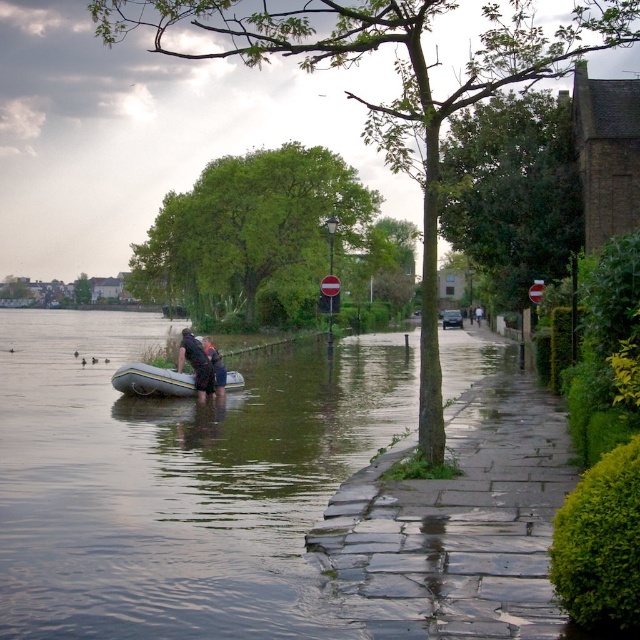
Which of these two, yellow rubber raft at lower left or dark blue fabric jacket at lower center, stands taller?

dark blue fabric jacket at lower center

At what (x,y) coordinates should I click in order to perform the action: click on yellow rubber raft at lower left. Please return your answer as a coordinate pair (x, y). This screenshot has height=640, width=640. Looking at the image, I should click on (152, 380).

The width and height of the screenshot is (640, 640). I want to click on yellow rubber raft at lower left, so click(152, 380).

Does translucent rubber raft at lower left have a lesser width compared to dark blue fabric person at center?

Incorrect, translucent rubber raft at lower left's width is not less than dark blue fabric person at center's.

In the scene shown: Can you confirm if translucent rubber raft at lower left is positioned below dark blue fabric person at center?

Indeed, translucent rubber raft at lower left is positioned under dark blue fabric person at center.

Which is behind, point (33, 509) or point (214, 349)?

The point (214, 349) is more distant.

At what (x,y) coordinates should I click in order to perform the action: click on translucent rubber raft at lower left. Please return your answer as a coordinate pair (x, y). This screenshot has width=640, height=640. Looking at the image, I should click on (177, 481).

How far apart are dark blue fabric jacket at lower center and dark blue fabric person at center?

They are 90.10 centimeters apart.

Can you confirm if dark blue fabric jacket at lower center is taller than dark blue fabric person at center?

Yes.

Which is behind, point (196, 353) or point (218, 381)?

The point (218, 381) is behind.

This screenshot has width=640, height=640. Identify the location of dark blue fabric jacket at lower center. (196, 364).